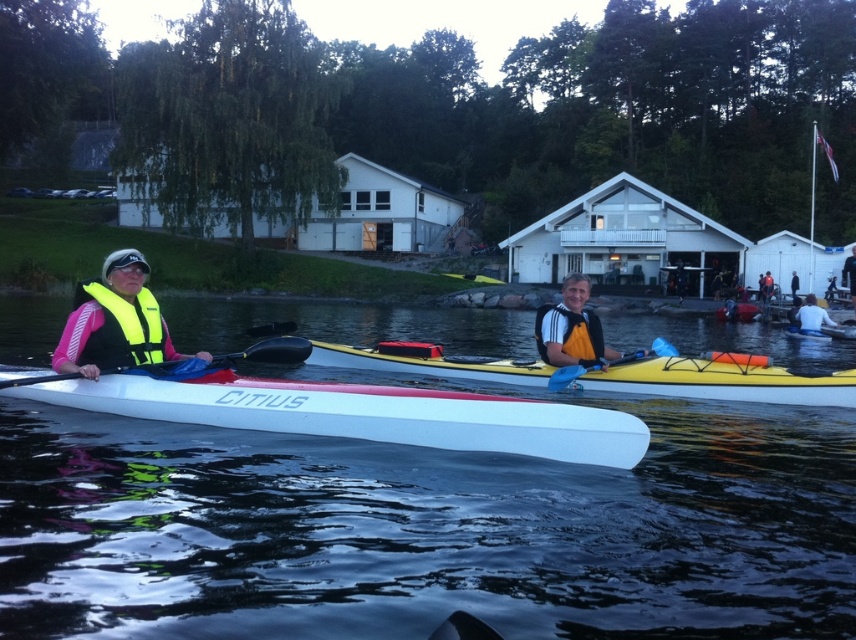
You are a photographer positioned on the shore and want to capture both the yellow matte canoe at center and the matte red canoe at center in your shot. Which canoe will appear closer to the camera in the photo?

The yellow matte canoe at center will appear closer to the camera because it is positioned in front of the matte red canoe at center.

You are a photographer positioned at the edge of the water, aiming to capture a clear shot of the white matte kayak at right without the blue plastic paddle at center blocking the view. Based on their positions, is this possible?

The blue plastic paddle at center is in front of the white matte kayak at right, so it will block the view. To capture the kayak clearly, you need to move to a position where the paddle is no longer in front of it.